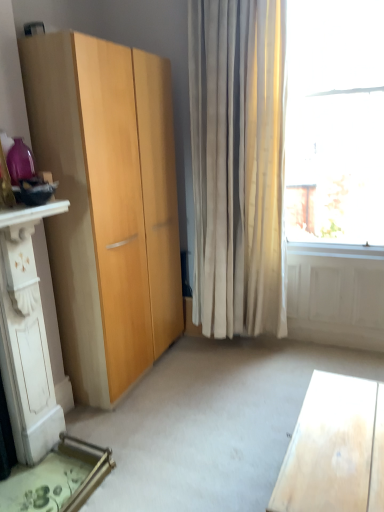
This screenshot has height=512, width=384. Describe the element at coordinates (26, 336) in the screenshot. I see `white carved wood dresser at lower left` at that location.

Identify the location of white carved wood dresser at lower left. (26, 336).

Where is `light wood desk at lower right`? light wood desk at lower right is located at coordinates (x=335, y=449).

Describe the element at coordinates (335, 449) in the screenshot. I see `light wood desk at lower right` at that location.

Locate an element on the screen. This screenshot has height=512, width=384. white carved wood dresser at lower left is located at coordinates (26, 336).

Is light wood desk at lower right at the left side of white carved wood dresser at lower left?

No, light wood desk at lower right is not to the left of white carved wood dresser at lower left.

Is light wood desk at lower right positioned before white carved wood dresser at lower left?

Yes.

Which is less distant, (300, 495) or (20, 355)?

Point (300, 495)

From the image's perspective, does light wood desk at lower right appear higher than white carved wood dresser at lower left?

No, from the image's perspective, light wood desk at lower right is not on top of white carved wood dresser at lower left.

From a real-world perspective, is light wood desk at lower right physically below white carved wood dresser at lower left?

Yes, from a real-world perspective, light wood desk at lower right is beneath white carved wood dresser at lower left.

Which of these two, light wood desk at lower right or white carved wood dresser at lower left, is wider?

white carved wood dresser at lower left is wider.

Considering the relative sizes of light wood desk at lower right and white carved wood dresser at lower left in the image provided, is light wood desk at lower right shorter than white carved wood dresser at lower left?

Indeed, light wood desk at lower right has a lesser height compared to white carved wood dresser at lower left.

Consider the image. Who is smaller, light wood desk at lower right or white carved wood dresser at lower left?

Smaller between the two is light wood desk at lower right.

Is white carved wood dresser at lower left surrounded by light wood desk at lower right?

No, white carved wood dresser at lower left is not inside light wood desk at lower right.

Is light wood desk at lower right far away from white carved wood dresser at lower left?

Indeed, light wood desk at lower right is not near white carved wood dresser at lower left.

Is light wood desk at lower right turned away from white carved wood dresser at lower left?

No.

How many degrees apart are the facing directions of light wood desk at lower right and white carved wood dresser at lower left?

The angular difference between light wood desk at lower right and white carved wood dresser at lower left is 179 degrees.

Where is `dresser lying on the left of light wood desk at lower right`? dresser lying on the left of light wood desk at lower right is located at coordinates (26, 336).

Can you confirm if white carved wood dresser at lower left is positioned to the right of light wood desk at lower right?

Incorrect, white carved wood dresser at lower left is not on the right side of light wood desk at lower right.

Which object is more forward, white carved wood dresser at lower left or light wood desk at lower right?

light wood desk at lower right is more forward.

Is point (18, 346) closer or farther from the camera than point (374, 507)?

Point (18, 346) is positioned farther from the camera compared to point (374, 507).

From the image's perspective, is white carved wood dresser at lower left on light wood desk at lower right?

Yes, from the image's perspective, white carved wood dresser at lower left is on top of light wood desk at lower right.

In the scene shown: From a real-world perspective, who is located lower, white carved wood dresser at lower left or light wood desk at lower right?

In real-world perspective, light wood desk at lower right is lower.

In terms of width, does white carved wood dresser at lower left look wider or thinner when compared to light wood desk at lower right?

Clearly, white carved wood dresser at lower left has more width compared to light wood desk at lower right.

Who is taller, white carved wood dresser at lower left or light wood desk at lower right?

With more height is white carved wood dresser at lower left.

Considering the sizes of objects white carved wood dresser at lower left and light wood desk at lower right in the image provided, who is smaller, white carved wood dresser at lower left or light wood desk at lower right?

With smaller size is light wood desk at lower right.

Which is correct: white carved wood dresser at lower left is inside light wood desk at lower right, or outside of it?

white carved wood dresser at lower left exists outside the volume of light wood desk at lower right.

Is white carved wood dresser at lower left directly adjacent to light wood desk at lower right?

No, white carved wood dresser at lower left is not in contact with light wood desk at lower right.

Does white carved wood dresser at lower left turn towards light wood desk at lower right?

Yes, white carved wood dresser at lower left is oriented towards light wood desk at lower right.

How different are the orientations of white carved wood dresser at lower left and light wood desk at lower right in degrees?

There is a 179-degree angle between the facing directions of white carved wood dresser at lower left and light wood desk at lower right.

Image resolution: width=384 pixels, height=512 pixels. I want to click on dresser located above the light wood desk at lower right (from a real-world perspective), so click(x=26, y=336).

Locate an element on the screen. This screenshot has height=512, width=384. desk in front of the white carved wood dresser at lower left is located at coordinates (335, 449).

Find the location of `dresser on the left of light wood desk at lower right`. dresser on the left of light wood desk at lower right is located at coordinates pos(26,336).